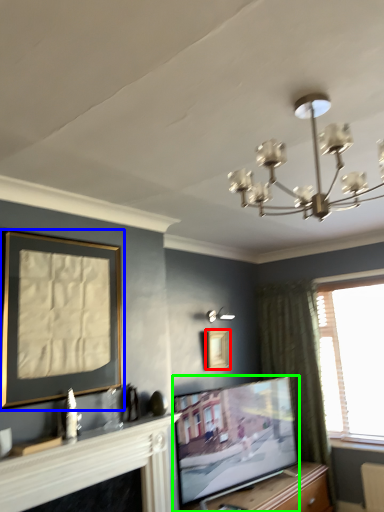
Question: Which object is positioned closest to picture frame (highlighted by a red box)? Select from picture frame (highlighted by a blue box) and television (highlighted by a green box).

Choices:
 (A) picture frame
 (B) television

Answer: (B)